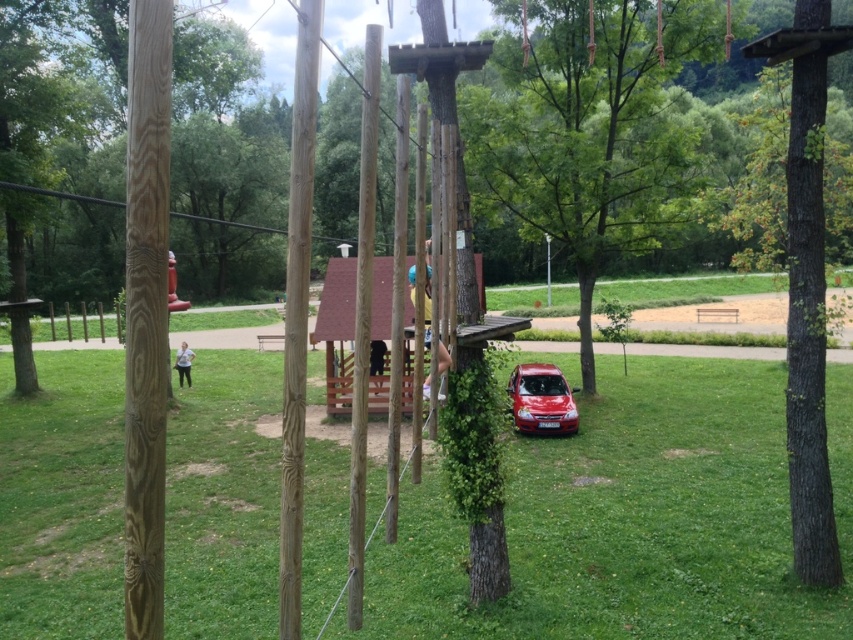
Question: Which object is closer to the camera taking this photo?

Choices:
 (A) natural wood pole at left
 (B) smooth wooden pole at center

Answer: (A)

Question: Does green leafy tree at center appear on the left side of smooth wood pole at center?

Choices:
 (A) no
 (B) yes

Answer: (A)

Question: Which point is farther to the camera?

Choices:
 (A) (364, 333)
 (B) (306, 3)
 (C) (529, 372)
 (D) (309, 548)

Answer: (C)

Question: Which of these objects is positioned closest to the green rough bark tree at center?

Choices:
 (A) green leafy tree at center
 (B) natural wood pole at left
 (C) smooth wood pole at center

Answer: (C)

Question: Is green grass at lower center positioned at the back of green rough bark tree at center?

Choices:
 (A) yes
 (B) no

Answer: (B)

Question: Does natural wood pole at left have a lesser width compared to smooth wood pole at center?

Choices:
 (A) yes
 (B) no

Answer: (B)